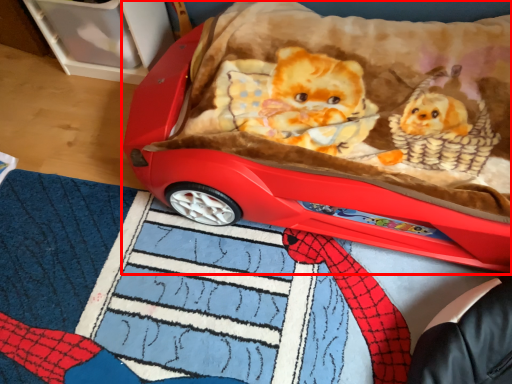
Question: From the image's perspective, considering the relative positions of toy (annotated by the red box) and mat in the image provided, where is toy (annotated by the red box) located with respect to the staircase?

Choices:
 (A) above
 (B) below

Answer: (A)